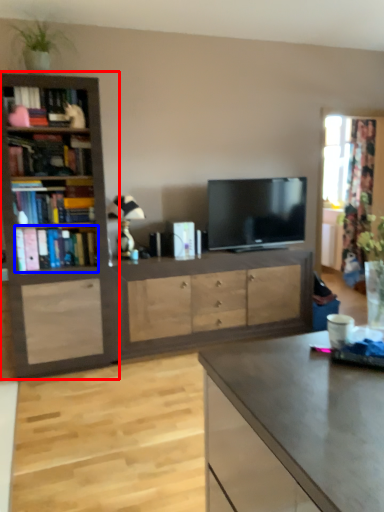
Question: Which object is further to the camera taking this photo, bookcase (highlighted by a red box) or book (highlighted by a blue box)?

Choices:
 (A) bookcase
 (B) book

Answer: (B)